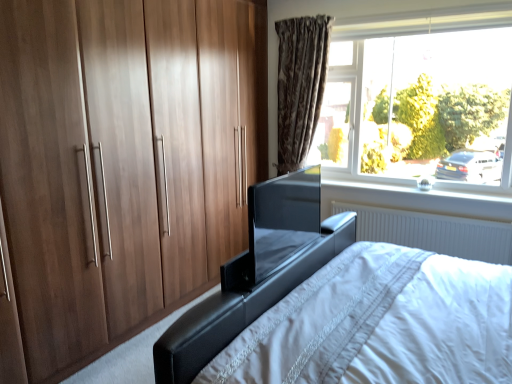
Where is `vacant region above black leather bed frame at lower center (from a real-world perspective)`? This screenshot has width=512, height=384. vacant region above black leather bed frame at lower center (from a real-world perspective) is located at coordinates (320, 307).